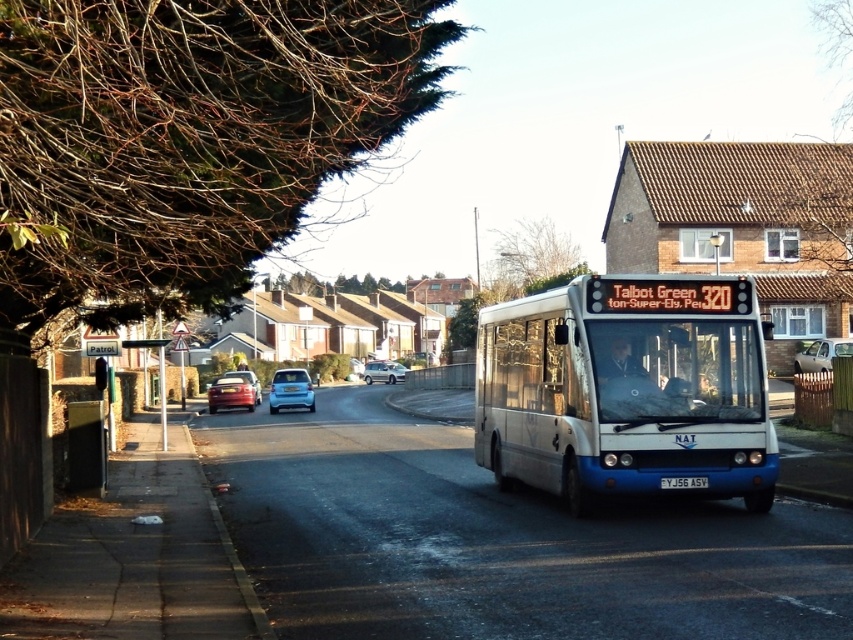
Who is shorter, bare branches at upper center or light blue metallic hatchback at center?

With less height is light blue metallic hatchback at center.

Is bare branches at upper center further to the viewer compared to light blue metallic hatchback at center?

Yes, bare branches at upper center is behind light blue metallic hatchback at center.

What do you see at coordinates (534, 259) in the screenshot?
I see `bare branches at upper center` at bounding box center [534, 259].

At what (x,y) coordinates should I click in order to perform the action: click on bare branches at upper center. Please return your answer as a coordinate pair (x, y). The height and width of the screenshot is (640, 853). Looking at the image, I should click on (534, 259).

Describe the element at coordinates (625, 388) in the screenshot. I see `white metallic bus at center` at that location.

Which is in front, point (535, 371) or point (366, 282)?

Point (535, 371) is in front.

Image resolution: width=853 pixels, height=640 pixels. Identify the location of white metallic bus at center. (x=625, y=388).

Does green leafy tree at upper center appear under metallic silver car at center?

No, green leafy tree at upper center is not below metallic silver car at center.

Who is positioned more to the left, green leafy tree at upper center or metallic silver car at center?

Positioned to the left is green leafy tree at upper center.

Who is more distant from viewer, (281, 275) or (379, 364)?

The point (281, 275) is behind.

The image size is (853, 640). In order to click on green leafy tree at upper center in this screenshot , I will do `click(335, 284)`.